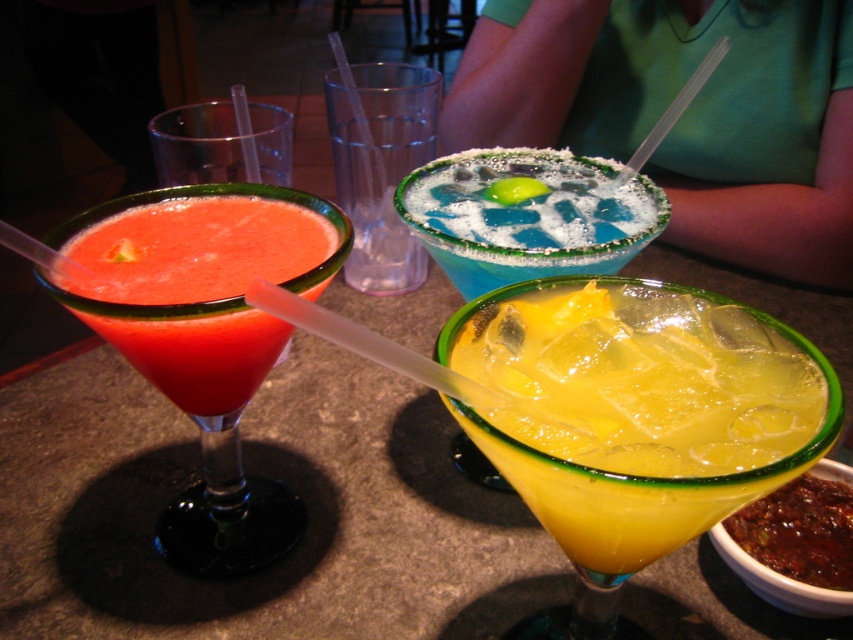
You are at a party and see two cups on the table. You need to grab the one that is on the left side. Which cup should you choose between the translucent plastic cup at center and the transparent plastic cup at upper left?

The transparent plastic cup at upper left is on the left side, so you should choose the transparent plastic cup at upper left.

You are a bartender and need to serve a drink to a customer who prefers taller drinks. Which of the two drinks, the yellow translucent liquid at center or the blue salted rimmed glass at center, should you choose?

The yellow translucent liquid at center is much taller than the blue salted rimmed glass at center, so you should choose the yellow translucent liquid at center.